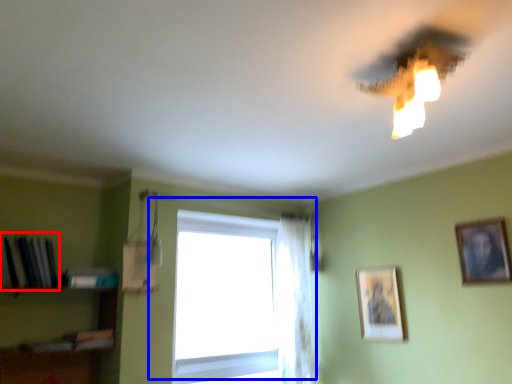
Question: Which point is closer to the camera, book (highlighted by a red box) or window (highlighted by a blue box)?

Choices:
 (A) book
 (B) window

Answer: (A)